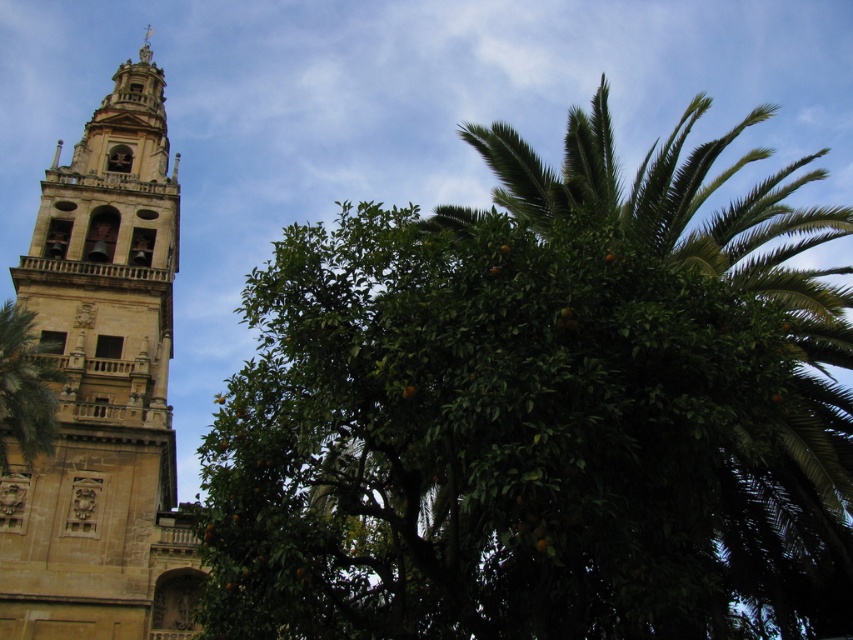
Question: Which object appears closest to the camera in this image?

Choices:
 (A) green leafy palm tree at left
 (B) green leafy orange tree at center

Answer: (B)

Question: Which of these objects is positioned farthest from the beige stone tower at left?

Choices:
 (A) green leafy palm tree at left
 (B) green leafy orange tree at center

Answer: (B)

Question: Observing the image, what is the correct spatial positioning of green leafy orange tree at center in reference to beige stone tower at left?

Choices:
 (A) below
 (B) above

Answer: (A)

Question: Which object is farther from the camera taking this photo?

Choices:
 (A) green leafy palm tree at left
 (B) green leafy orange tree at center
 (C) beige stone tower at left

Answer: (A)

Question: Does beige stone tower at left appear on the left side of green leafy palm tree at left?

Choices:
 (A) yes
 (B) no

Answer: (A)

Question: Is green leafy orange tree at center to the left of beige stone tower at left from the viewer's perspective?

Choices:
 (A) yes
 (B) no

Answer: (B)